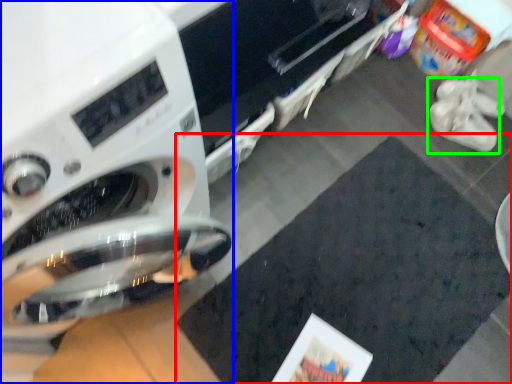
Question: Which object is the farthest from mat (highlighted by a red box)? Choose among these: washing machine (highlighted by a blue box) or footwear (highlighted by a green box).

Choices:
 (A) washing machine
 (B) footwear

Answer: (A)